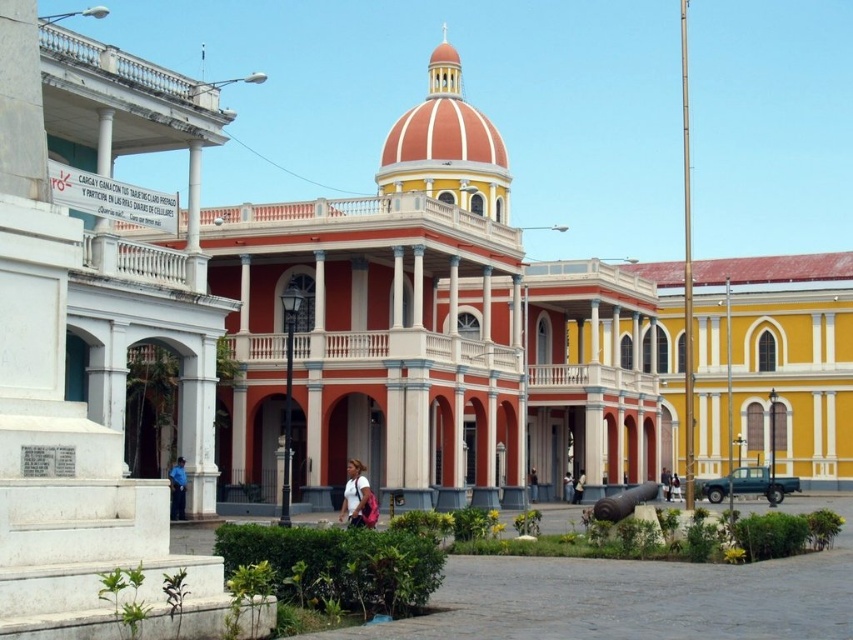
Looking at this image, you are standing in front of the scene and want to take a photo that includes both the matte red building at center and the light brown leather chair at center. Given their height difference, which object will appear larger in the photo?

The matte red building at center will appear larger in the photo because it is much taller than the light brown leather chair at center.

Consider the image. You are an architect visiting the historic site and notice the matte red building at center and the white fabric bag at center. Which object would you need to look up to see from your current position?

The matte red building at center is larger in size than the white fabric bag at center, so you would need to look up to see the matte red building at center since it is taller.